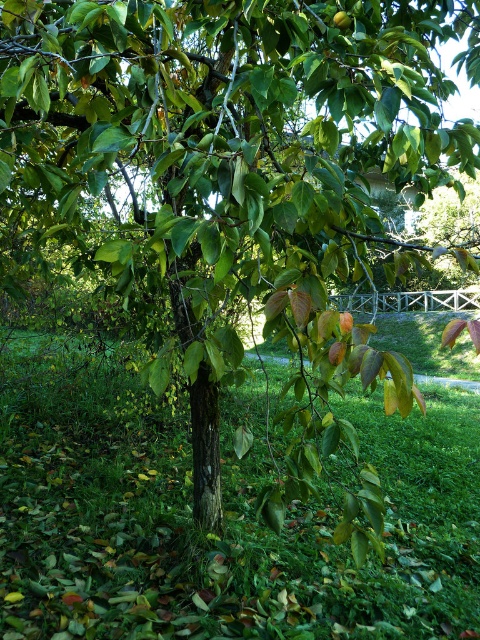
You are standing in front of the tree and looking at the two points marked in the image. Which point, point (340, 634) or point (340, 12), is closer to you?

Point (340, 12) is closer to you because it is less further to the camera than point (340, 634).

You are a gardener who wants to plant a new tree in the garden. You have a small space between the green grassy at center and the green matte apple at center. Which object has a wider area to accommodate the tree?

The green grassy at center has a larger width than the green matte apple at center, so it would be more suitable for planting the new tree.

You are standing in a park and see a tree with a slender trunk and a dense canopy. There is a wooden fence in the background. You want to place a small bench exactly 3 meters away from the point at coordinates point (343,560). Is this possible given the current layout?

The distance between point (343,560) and the viewer is 3.46 meters. Since the bench needs to be placed 3 meters away from the point, it is possible as 3 meters is less than 3.46 meters.